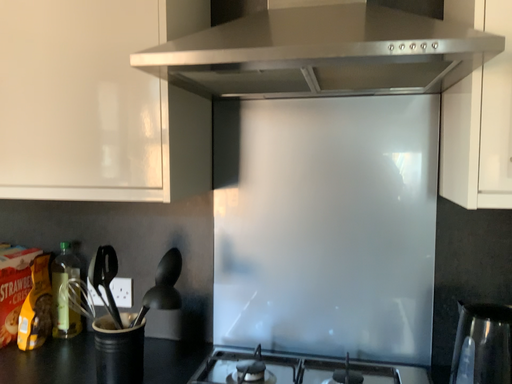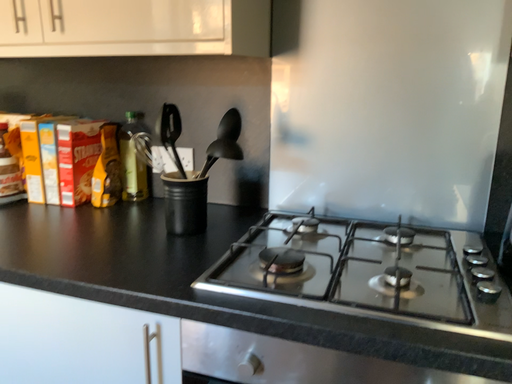
Question: Which way did the camera rotate in the video?

Choices:
 (A) rotated left
 (B) rotated right

Answer: (A)